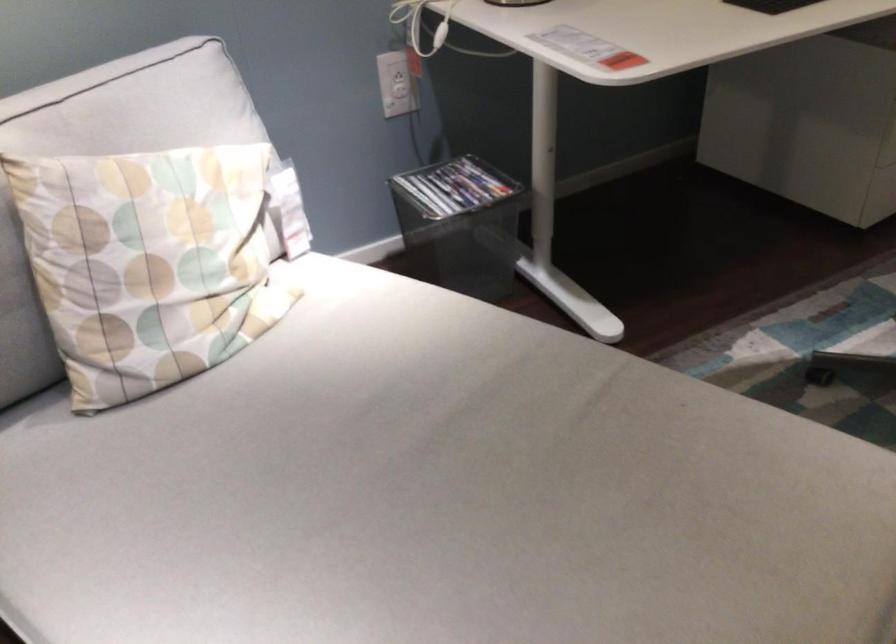
This screenshot has height=644, width=896. Describe the element at coordinates (400, 91) in the screenshot. I see `the white cable plug` at that location.